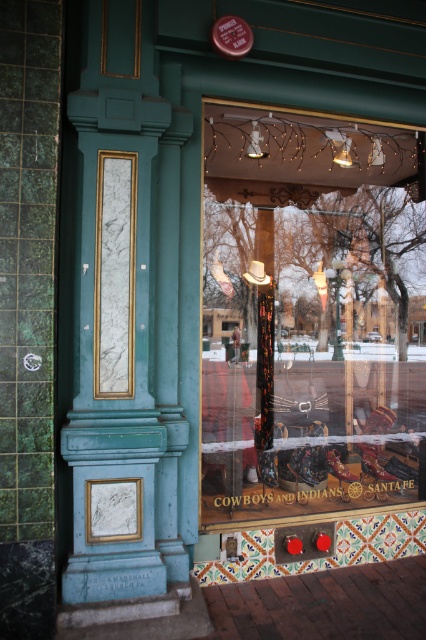
You are standing in front of the shop and want to touch both points on the shop window. Which point should you reach for first, the point at coordinates point (249, 221) or point (333, 451)?

You should reach for point (249, 221) first because it is closer to you than point (333, 451), which is further away.

Looking at this image, you are a customer looking to buy a pair of shoes for a casual event. You see the matte black cowboy boots at center and the shiny brown leather shoe at center in the shop window. Which one is wider?

The matte black cowboy boots at center are wider than the shiny brown leather shoe at center.